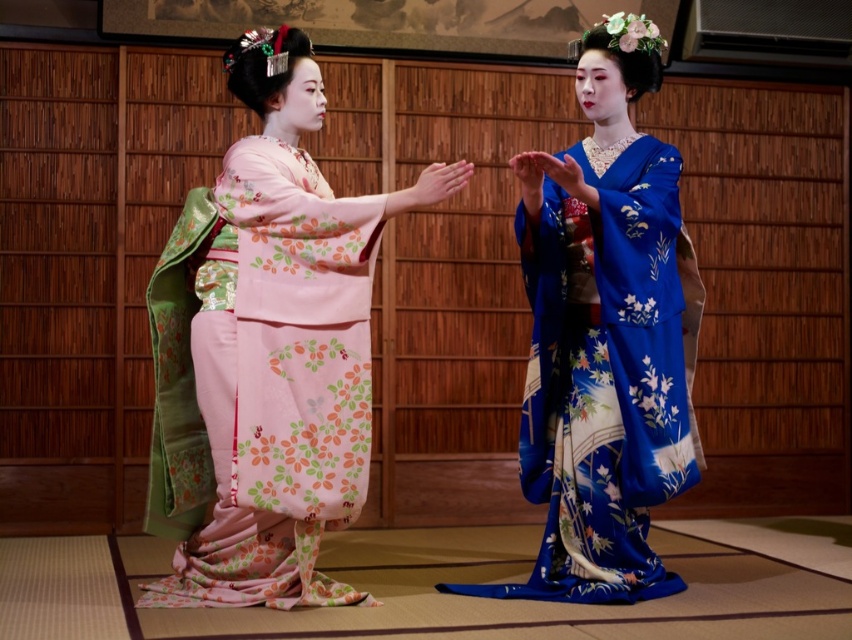
You are a photographer standing in front of the two kimonos. You want to take a photo that captures both the pink floral kimono at center and the blue silk kimono at center in the same frame. Given that your camera has a minimum focus distance of 3 feet, will you be able to focus on both subjects simultaneously?

The pink floral kimono at center and blue silk kimono at center are 37.65 inches apart. Since 37.65 inches is equal to 3.14 feet, which is slightly more than the camera minimum focus distance of 3 feet, you can focus on both subjects simultaneously.

You are standing at the entrance of a traditional Japanese tea house and see the pink floral kimono at center. If you want to take a photo of it without moving closer than 10 feet, will you be able to capture it clearly in your shot?

The pink floral kimono at center is 10.39 feet away from the camera. Since you are staying at least 10 feet away, you are within the required distance and can capture it clearly.

You are organizing a traditional Japanese cultural event and need to ensure that the kimonos provided are appropriately sized for the participants. Given the scene described, which kimono, the pink floral kimono at center or the blue silk kimono at center, would require a larger size to accommodate its current dimensions?

The pink floral kimono at center is bigger than the blue silk kimono at center, so it would require a larger size to accommodate its current dimensions.